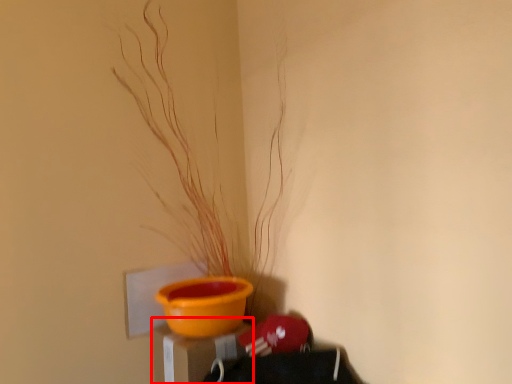
Question: Considering the relative positions of table (annotated by the red box) and houseplant in the image provided, where is table (annotated by the red box) located with respect to the staircase?

Choices:
 (A) left
 (B) right

Answer: (A)